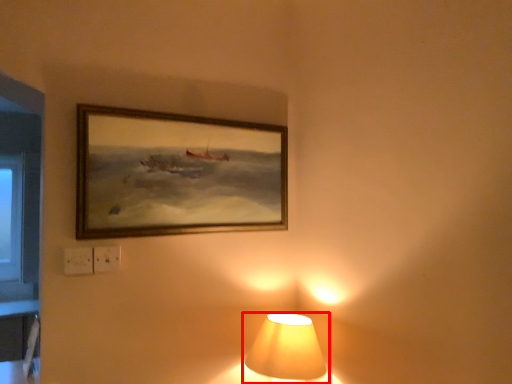
Question: From the image's perspective, where is lamp (annotated by the red box) located relative to picture frame?

Choices:
 (A) above
 (B) below

Answer: (B)